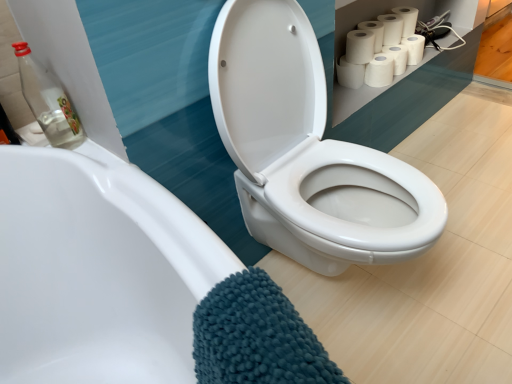
Question: From a real-world perspective, is white matte toilet paper at upper right, which ranks as the second toilet paper in right-to-left order, positioned over white glossy toilet at center based on gravity?

Choices:
 (A) yes
 (B) no

Answer: (A)

Question: Does white matte toilet paper at upper right, the sixth toilet paper positioned from the left, have a lesser height compared to white glossy toilet at center?

Choices:
 (A) no
 (B) yes

Answer: (B)

Question: Does white matte toilet paper at upper right, the sixth toilet paper positioned from the left, touch white glossy toilet at center?

Choices:
 (A) yes
 (B) no

Answer: (B)

Question: Can you confirm if white matte toilet paper at upper right, the sixth toilet paper positioned from the left, is thinner than white glossy toilet at center?

Choices:
 (A) no
 (B) yes

Answer: (B)

Question: From a real-world perspective, is white matte toilet paper at upper right, the sixth toilet paper positioned from the left, below white glossy toilet at center?

Choices:
 (A) no
 (B) yes

Answer: (A)

Question: From the image's perspective, is white matte paper towel at upper right above or below white matte toilet paper at upper right, positioned as the 5th toilet paper in right-to-left order?

Choices:
 (A) above
 (B) below

Answer: (A)

Question: Considering the positions of white matte paper towel at upper right and white matte toilet paper at upper right, positioned as the 5th toilet paper in right-to-left order, in the image, is white matte paper towel at upper right wider or thinner than white matte toilet paper at upper right, positioned as the 5th toilet paper in right-to-left order,?

Choices:
 (A) wide
 (B) thin

Answer: (A)

Question: In the image, is white matte paper towel at upper right positioned in front of or behind white matte toilet paper at upper right, the third toilet paper in the left-to-right sequence?

Choices:
 (A) front
 (B) behind

Answer: (A)

Question: Is point (366, 48) closer or farther from the camera than point (386, 84)?

Choices:
 (A) closer
 (B) farther

Answer: (A)

Question: From the image's perspective, relative to white matte toilet paper at upper right, marked as the 5th toilet paper in a left-to-right arrangement, is white glossy toilet at center above or below?

Choices:
 (A) below
 (B) above

Answer: (A)

Question: Is white glossy toilet at center wider or thinner than white matte toilet paper at upper right, marked as the 5th toilet paper in a left-to-right arrangement?

Choices:
 (A) wide
 (B) thin

Answer: (A)

Question: Is white glossy toilet at center taller or shorter than white matte toilet paper at upper right, marked as the 5th toilet paper in a left-to-right arrangement?

Choices:
 (A) short
 (B) tall

Answer: (B)

Question: Considering the positions of white glossy toilet at center and white matte toilet paper at upper right, marked as the 5th toilet paper in a left-to-right arrangement, in the image, is white glossy toilet at center bigger or smaller than white matte toilet paper at upper right, marked as the 5th toilet paper in a left-to-right arrangement,?

Choices:
 (A) small
 (B) big

Answer: (B)

Question: In the image, is transparent glass bottle at upper left positioned in front of or behind white matte toilet paper at upper right, positioned as the 5th toilet paper in right-to-left order?

Choices:
 (A) front
 (B) behind

Answer: (A)

Question: From a real-world perspective, is transparent glass bottle at upper left positioned above or below white matte toilet paper at upper right, the third toilet paper in the left-to-right sequence?

Choices:
 (A) above
 (B) below

Answer: (A)